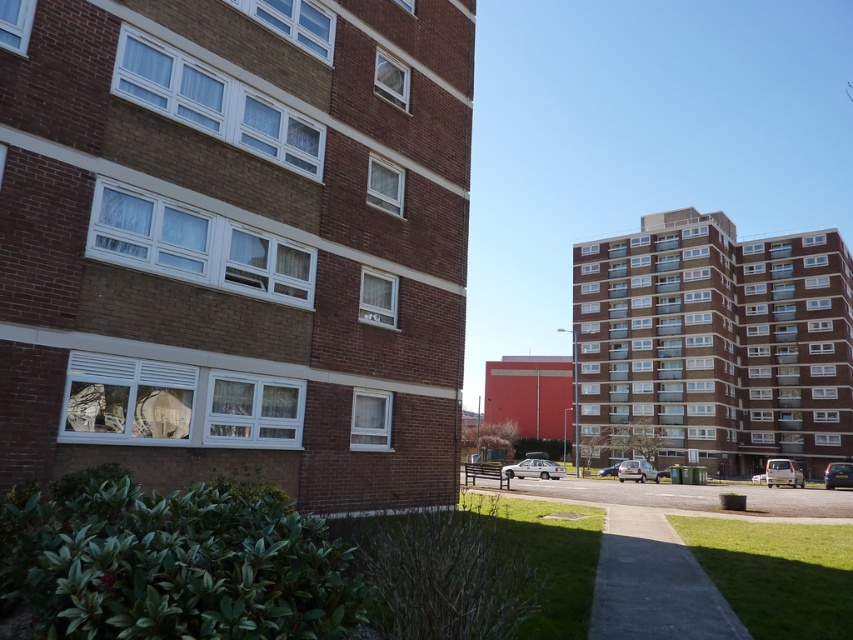
Is dark blue metallic car at lower right to the left of metallic silver car at center from the viewer's perspective?

Incorrect, dark blue metallic car at lower right is not on the left side of metallic silver car at center.

Who is taller, dark blue metallic car at lower right or metallic silver car at center?

Standing taller between the two is dark blue metallic car at lower right.

Between point (840, 476) and point (604, 468), which one is positioned in front?

Point (840, 476) is more forward.

Locate an element on the screen. The height and width of the screenshot is (640, 853). dark blue metallic car at lower right is located at coordinates (838, 474).

Which of these two, silver metallic sedan at center or silver metallic car at center, stands taller?

Standing taller between the two is silver metallic sedan at center.

Can you confirm if silver metallic sedan at center is bigger than silver metallic car at center?

Yes.

Does point (532, 467) come behind point (642, 481)?

No, it is in front of (642, 481).

Where is `silver metallic sedan at center`? Image resolution: width=853 pixels, height=640 pixels. silver metallic sedan at center is located at coordinates (532, 468).

Is metallic silver van at lower right positioned at the back of metallic silver car at center?

No, it is in front of metallic silver car at center.

From the picture: Is metallic silver van at lower right shorter than metallic silver car at center?

Incorrect, metallic silver van at lower right's height does not fall short of metallic silver car at center's.

Is point (769, 460) positioned behind point (602, 476)?

No, (769, 460) is closer to viewer.

You are a GUI agent. You are given a task and a screenshot of the screen. Output one action in this format:
    pyautogui.click(x=<x>, y=<y>)
    Task: Click on the metallic silver van at lower right
    Image resolution: width=853 pixels, height=640 pixels.
    Given the screenshot: What is the action you would take?
    pos(782,472)